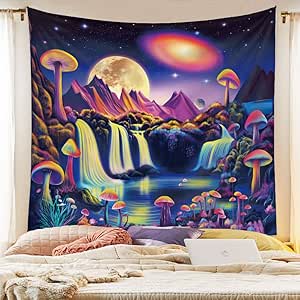
You are a GUI agent. You are given a task and a screenshot of the screen. Output one action in this format:
    pyautogui.click(x=<x>, y=<y>)
    Task: Click on the curtain rod
    The image size is (300, 300).
    Given the screenshot: What is the action you would take?
    pyautogui.click(x=286, y=16)